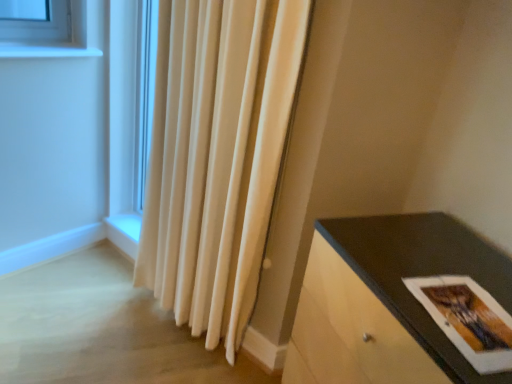
Find the location of a particular element. free space to the back side of matte paper postcard at lower right is located at coordinates (414, 253).